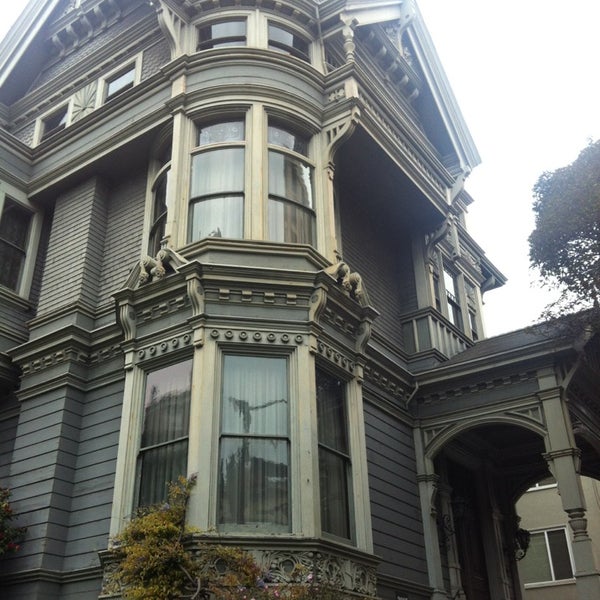
Where is `window`? window is located at coordinates (270, 430).